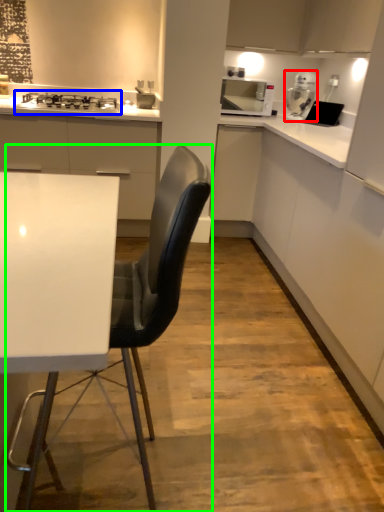
Question: Considering the real-world distances, which object is closest to kitchen appliance (highlighted by a red box)? gas stove (highlighted by a blue box) or chair (highlighted by a green box).

Choices:
 (A) gas stove
 (B) chair

Answer: (A)